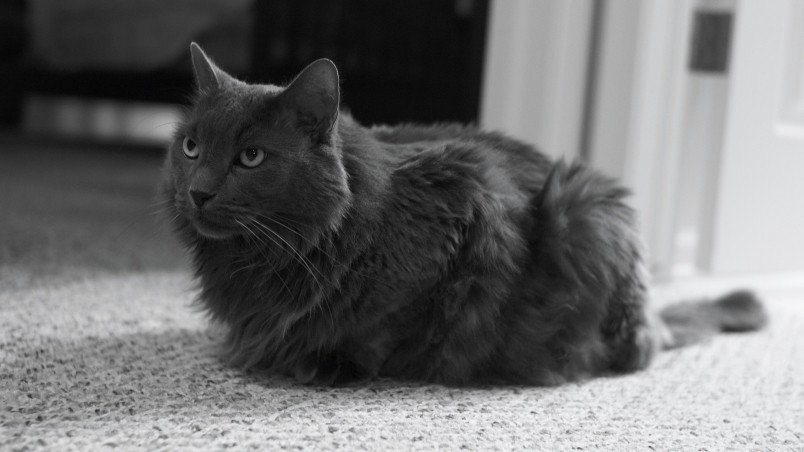
Find the location of a particular element. The height and width of the screenshot is (452, 804). hinge is located at coordinates (716, 45).